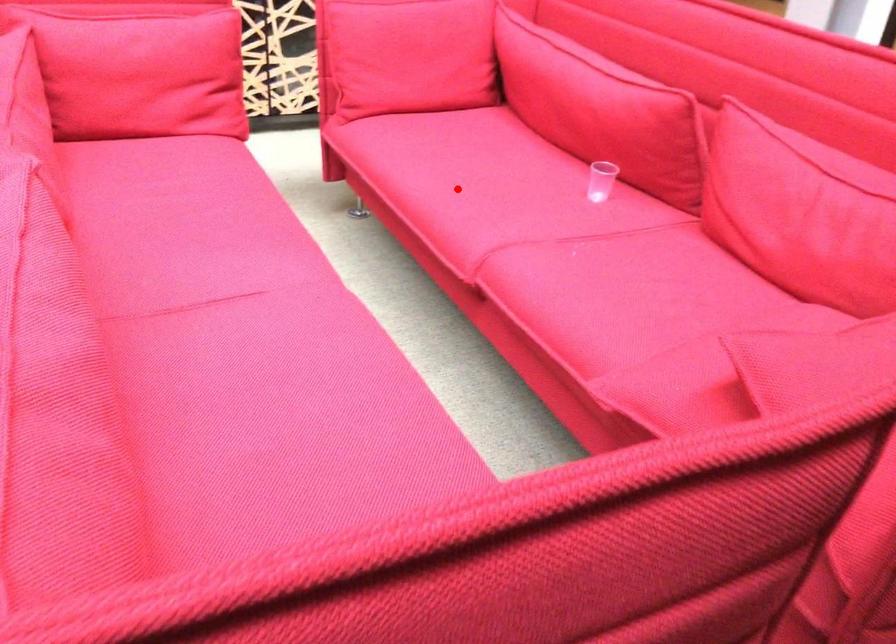
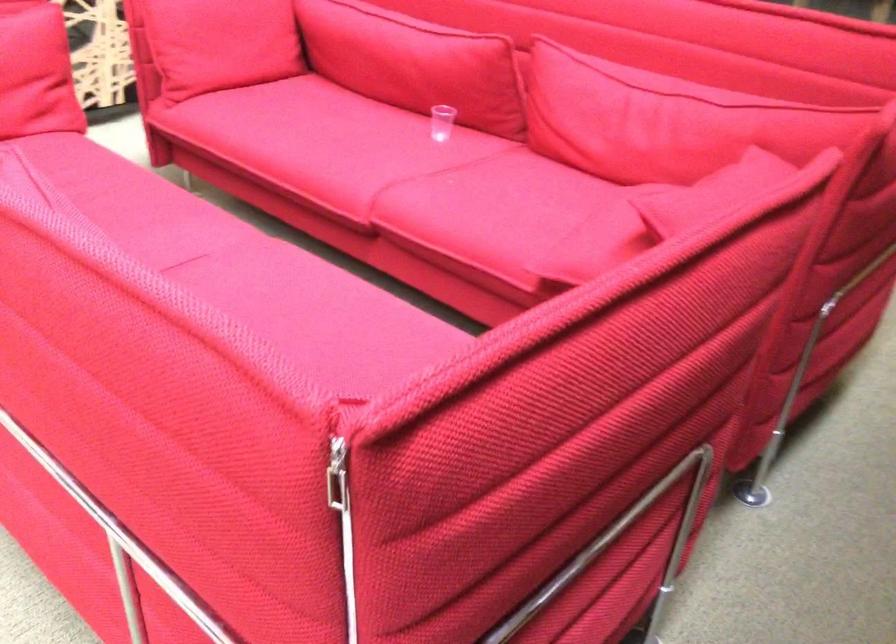
The point at the highlighted location is marked in the first image. Where is the corresponding point in the second image?

(320, 146)